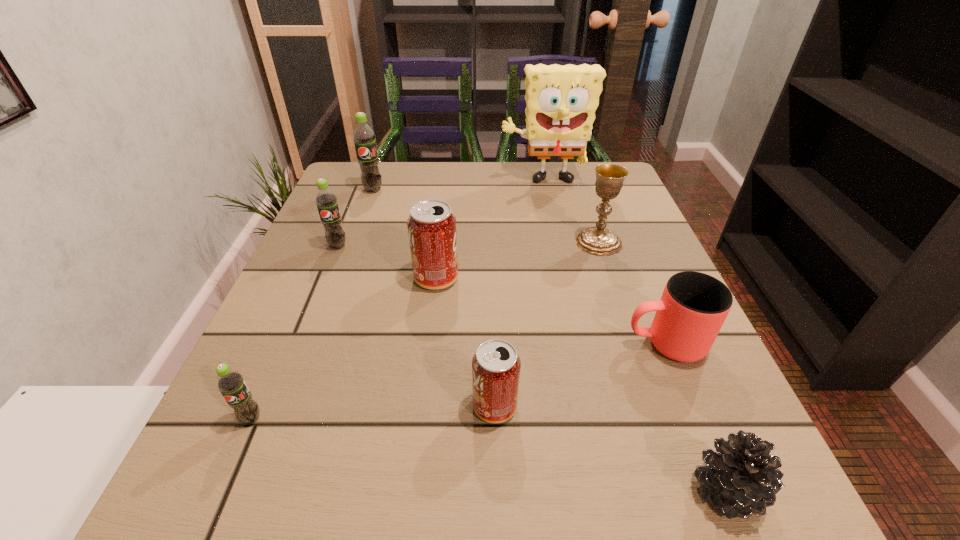
The width and height of the screenshot is (960, 540). What are the coordinates of `vacant area in the image that satisfies the following two spatial constraints: 1. on the face of the tallest object; 2. on the handle side of the fourth nearest object` in the screenshot? It's located at (579, 343).

Find the location of a particular element. The height and width of the screenshot is (540, 960). free space that satisfies the following two spatial constraints: 1. on the front label of the second biggest green soda; 2. on the right side of the right red soda can is located at coordinates (273, 406).

Locate an element on the screen. This screenshot has height=540, width=960. vacant space that satisfies the following two spatial constraints: 1. on the front label of the second smallest green soda; 2. on the handle side of the sixth farthest object is located at coordinates (299, 343).

The width and height of the screenshot is (960, 540). What are the coordinates of `free location that satisfies the following two spatial constraints: 1. on the front label of the tallest soda; 2. on the right side of the gold chalice` in the screenshot? It's located at (354, 242).

Where is `free space that satisfies the following two spatial constraints: 1. on the face of the tallest object; 2. on the right side of the chalice`? free space that satisfies the following two spatial constraints: 1. on the face of the tallest object; 2. on the right side of the chalice is located at coordinates (556, 242).